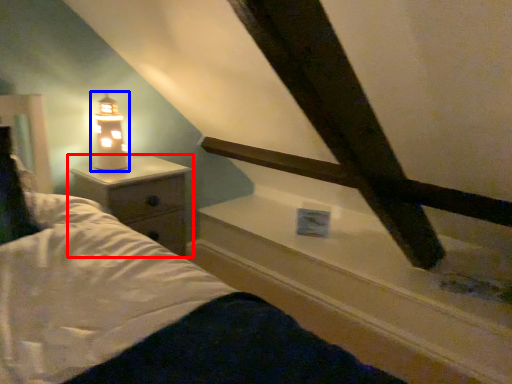
Question: Which object is closer to the camera taking this photo, nightstand (highlighted by a red box) or lamp (highlighted by a blue box)?

Choices:
 (A) nightstand
 (B) lamp

Answer: (A)